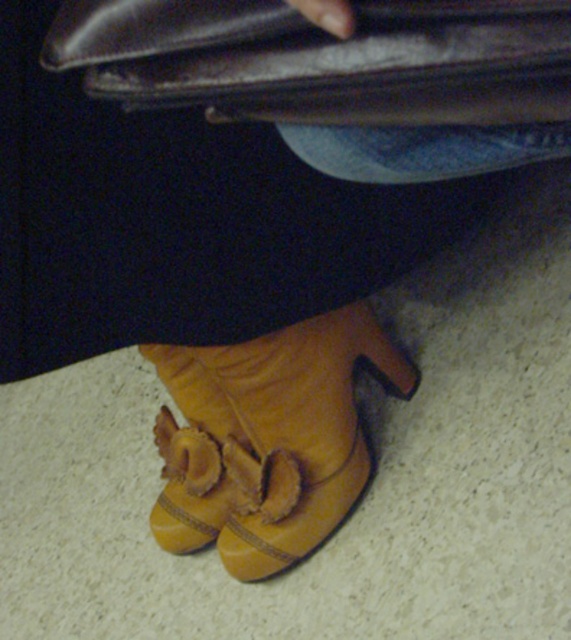
Question: In this image, where is leather bag at upper center located relative to suede boot at lower center?

Choices:
 (A) right
 (B) left

Answer: (A)

Question: Is leather bag at upper center closer to the viewer compared to suede boot at lower center?

Choices:
 (A) no
 (B) yes

Answer: (B)

Question: In this image, where is leather bag at upper center located relative to suede boot at lower center?

Choices:
 (A) left
 (B) right

Answer: (B)